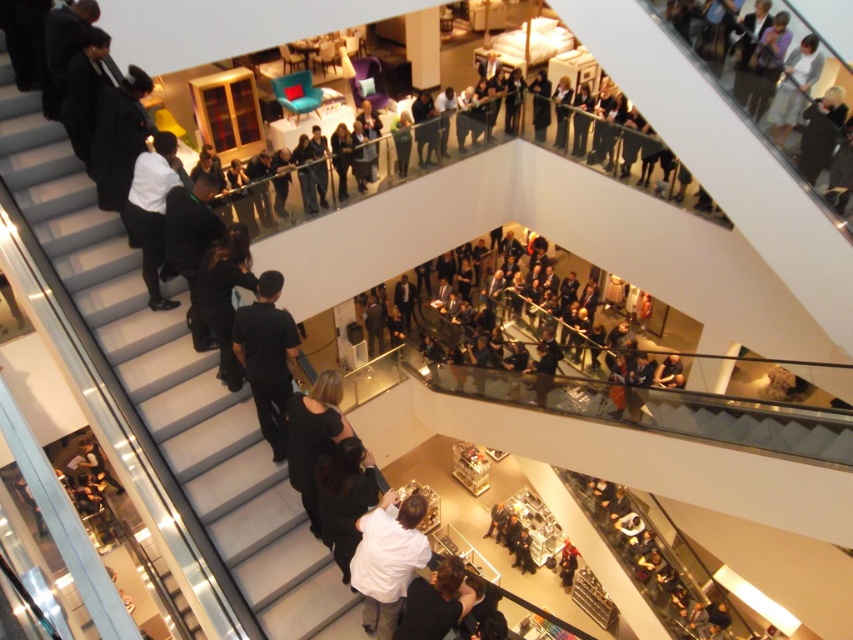
Question: Estimate the real-world distances between objects in this image. Which object is farther from the black fabric at center?

Choices:
 (A) black matte dress at center
 (B) black matte pants at left

Answer: (A)

Question: Considering the real-world distances, which object is closest to the white matte shirt at left?

Choices:
 (A) black fabric at center
 (B) black matte dress at center
 (C) dark gray fabric crowd at center
 (D) white glossy stairs at left

Answer: (B)

Question: Does black matte pants at left have a lesser width compared to black matte dress at center?

Choices:
 (A) yes
 (B) no

Answer: (A)

Question: Considering the real-world distances, which object is farthest from the black matte pants at left?

Choices:
 (A) white matte shirt at left
 (B) white glossy stairs at left

Answer: (A)

Question: Does black fabric at center appear under dark brown leather jacket at lower center?

Choices:
 (A) yes
 (B) no

Answer: (B)

Question: Does dark gray fabric crowd at center appear over black matte dress at center?

Choices:
 (A) yes
 (B) no

Answer: (B)